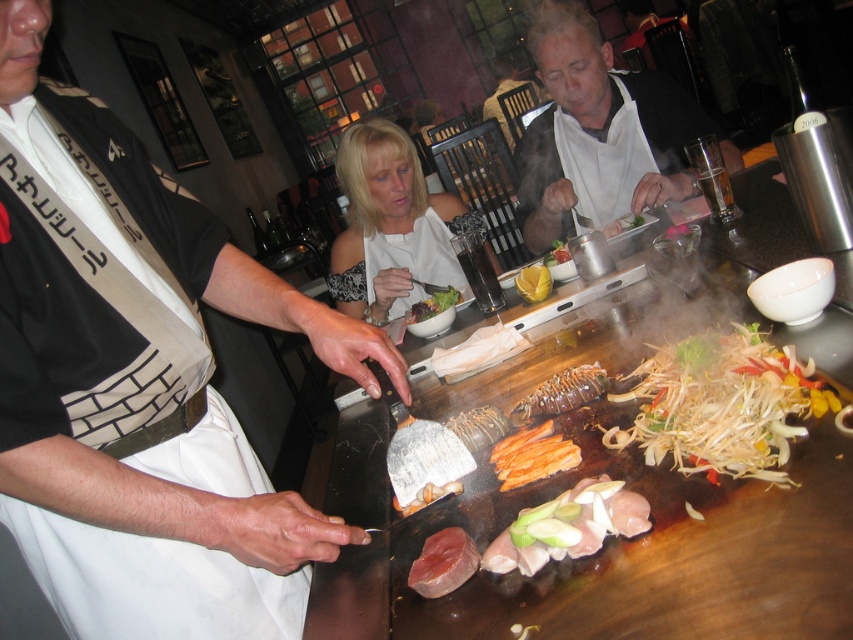
Question: Can you confirm if white glossy shirt at upper center is positioned to the right of smooth orange slices at center?

Choices:
 (A) no
 (B) yes

Answer: (B)

Question: Observing the image, what is the correct spatial positioning of white glossy shirt at upper center in reference to smooth orange slices at center?

Choices:
 (A) below
 (B) above

Answer: (B)

Question: Which object appears farthest from the camera in this image?

Choices:
 (A) white glossy sliced onions at center
 (B) smooth white plate at center
 (C) brown glossy lobster at center

Answer: (B)

Question: Which of the following is the farthest from the observer?

Choices:
 (A) white glossy shirt at upper center
 (B) pink glossy raw fish at center

Answer: (A)

Question: Does white fabric apron at center appear under white matte dress at center?

Choices:
 (A) yes
 (B) no

Answer: (A)

Question: Which object is farther from the camera taking this photo?

Choices:
 (A) smooth white plate at center
 (B) pink glossy raw fish at center
 (C) golden-brown crusty lobster at center

Answer: (A)